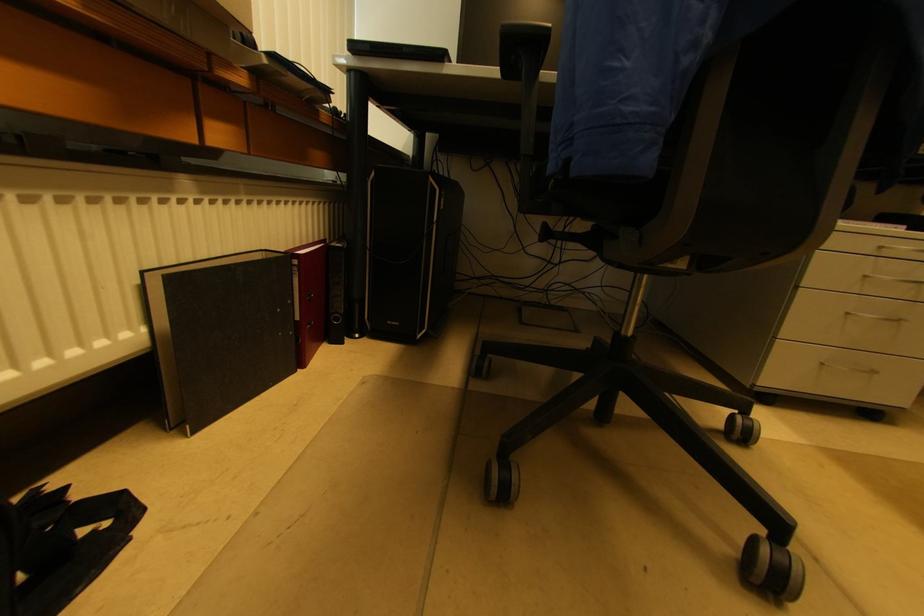
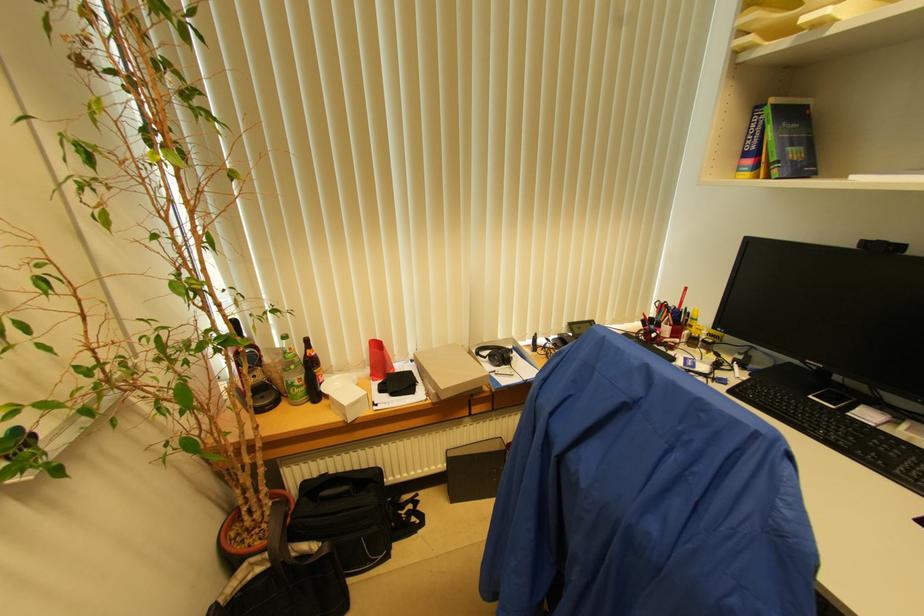
In the second image, find the point that corresponds to point (143, 275) in the first image.

(447, 453)